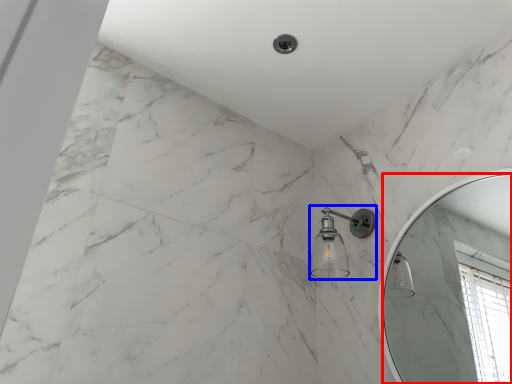
Question: Which object is closer to the camera taking this photo, mirror (highlighted by a red box) or shower (highlighted by a blue box)?

Choices:
 (A) mirror
 (B) shower

Answer: (A)